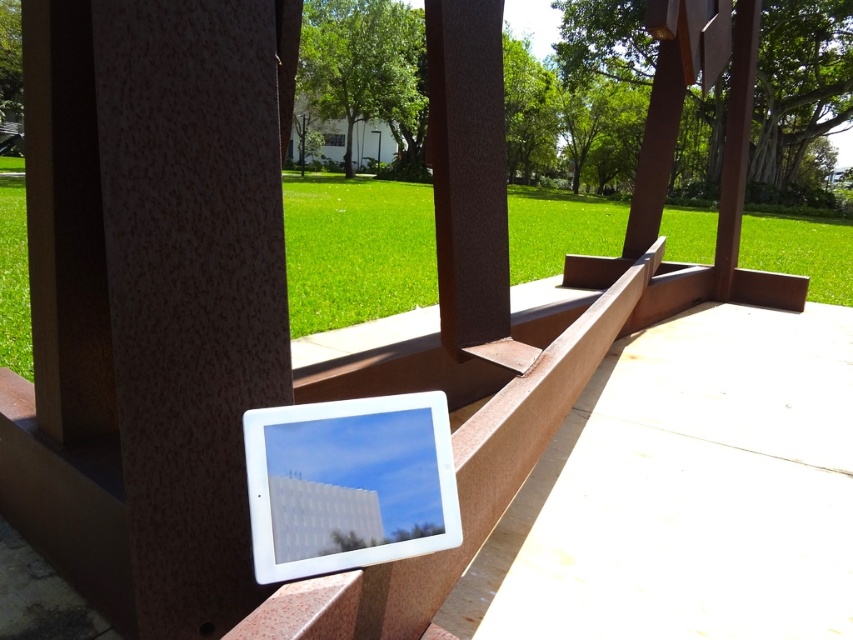
You are standing on a balcony and want to take a photo of the brown matte wood at center through the wooden railing. However, there is a white glossy tablet at center in your way. Can you move the tablet to capture the wood without obstruction?

The white glossy tablet at center is in front of the brown matte wood at center, so moving the tablet would allow you to capture the wood without obstruction.

You are standing on a balcony looking through the wooden railing. You see two points marked on the tablet screen at coordinates point (302,300) and point (515,353). Which point is closer to your eyes?

Point (302,300) is further to the camera than point (515,353), so the point closer to your eyes is point (515,353).

Consider the image. You are standing on a balcony and see the green grass at center represented by point (357, 250). If you want to walk towards that point, which direction should you move relative to your current position?

The green grass at center is represented by point (357, 250). Since the point is at the center of the image, you should move forward to reach it.